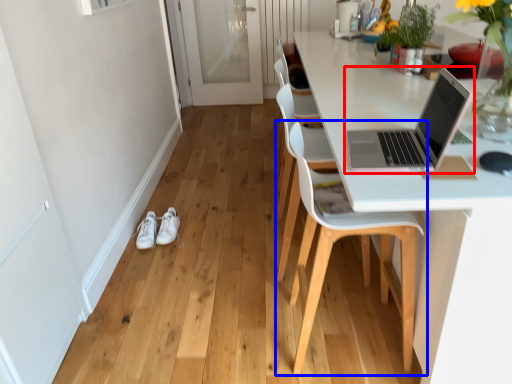
Question: Which object appears farthest to the camera in this image, laptop (highlighted by a red box) or chair (highlighted by a blue box)?

Choices:
 (A) laptop
 (B) chair

Answer: (B)